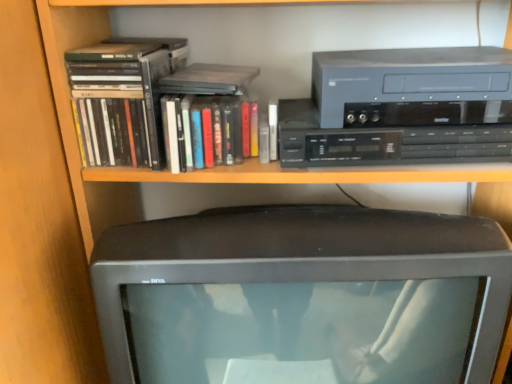
Question: Is matte gray cassette at upper right, the first cassette viewed from the top, thinner than black plastic cassette at upper right, arranged as the first cassette when ordered from the bottom?

Choices:
 (A) no
 (B) yes

Answer: (A)

Question: Does matte gray cassette at upper right, the first cassette viewed from the top, lie behind black plastic cassette at upper right, which is the 2th cassette in top-to-bottom order?

Choices:
 (A) no
 (B) yes

Answer: (A)

Question: From the image's perspective, does matte gray cassette at upper right, positioned as the second cassette in bottom-to-top order, appear higher than black plastic cassette at upper right, arranged as the first cassette when ordered from the bottom?

Choices:
 (A) yes
 (B) no

Answer: (A)

Question: Is matte gray cassette at upper right, positioned as the second cassette in bottom-to-top order, located outside black plastic cassette at upper right, arranged as the first cassette when ordered from the bottom?

Choices:
 (A) no
 (B) yes

Answer: (B)

Question: Is matte gray cassette at upper right, positioned as the second cassette in bottom-to-top order, next to black plastic cassette at upper right, arranged as the first cassette when ordered from the bottom, and touching it?

Choices:
 (A) yes
 (B) no

Answer: (A)

Question: Does matte gray cassette at upper right, positioned as the second cassette in bottom-to-top order, have a greater width compared to black plastic cassette at upper right, which is the 2th cassette in top-to-bottom order?

Choices:
 (A) no
 (B) yes

Answer: (B)

Question: Is the position of matte gray cassette at upper right, the first cassette viewed from the top, less distant than that of matte black monitor at center?

Choices:
 (A) no
 (B) yes

Answer: (A)

Question: From a real-world perspective, does matte gray cassette at upper right, the first cassette viewed from the top, sit lower than matte black monitor at center?

Choices:
 (A) no
 (B) yes

Answer: (A)

Question: Considering the relative positions of matte gray cassette at upper right, the first cassette viewed from the top, and matte black monitor at center in the image provided, is matte gray cassette at upper right, the first cassette viewed from the top, to the right of matte black monitor at center from the viewer's perspective?

Choices:
 (A) no
 (B) yes

Answer: (B)

Question: From the image's perspective, is matte gray cassette at upper right, positioned as the second cassette in bottom-to-top order, on top of matte black monitor at center?

Choices:
 (A) yes
 (B) no

Answer: (A)

Question: Is matte gray cassette at upper right, the first cassette viewed from the top, oriented away from matte black monitor at center?

Choices:
 (A) no
 (B) yes

Answer: (A)

Question: Does matte gray cassette at upper right, positioned as the second cassette in bottom-to-top order, have a greater height compared to matte black monitor at center?

Choices:
 (A) yes
 (B) no

Answer: (B)

Question: Does matte black book at upper left, the 2th book viewed from the right, appear on the left side of matte gray cassette at upper right, positioned as the second cassette in bottom-to-top order?

Choices:
 (A) no
 (B) yes

Answer: (B)